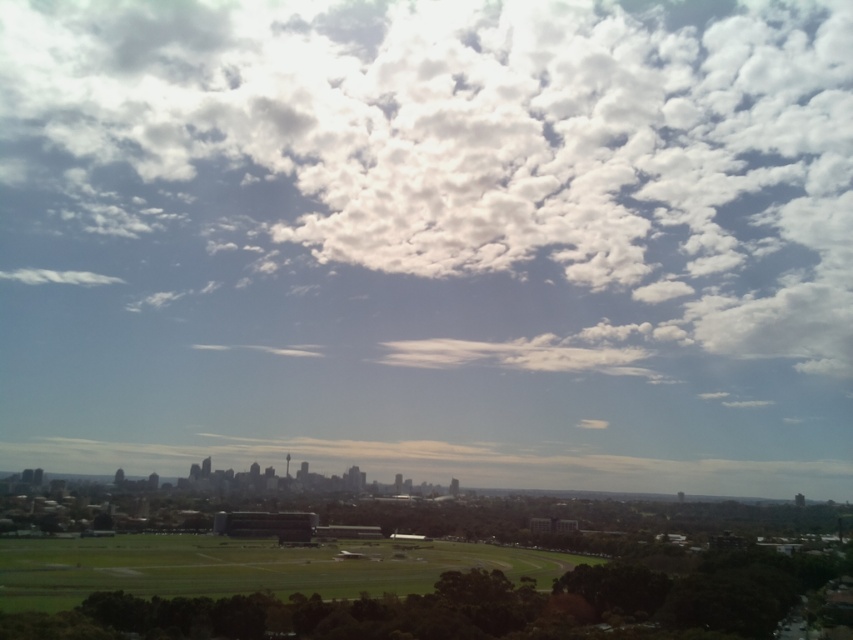
Question: Is white fluffy cloud at upper center bigger than green grassy field at lower center?

Choices:
 (A) no
 (B) yes

Answer: (B)

Question: Does white fluffy cloud at upper center have a greater width compared to green grassy field at lower center?

Choices:
 (A) no
 (B) yes

Answer: (B)

Question: Can you confirm if white fluffy cloud at upper center is thinner than green grassy field at lower center?

Choices:
 (A) no
 (B) yes

Answer: (A)

Question: Which point is farther from the camera taking this photo?

Choices:
 (A) (65, 552)
 (B) (785, 200)

Answer: (A)

Question: Which point is farther from the camera taking this photo?

Choices:
 (A) (257, 173)
 (B) (183, 556)

Answer: (A)